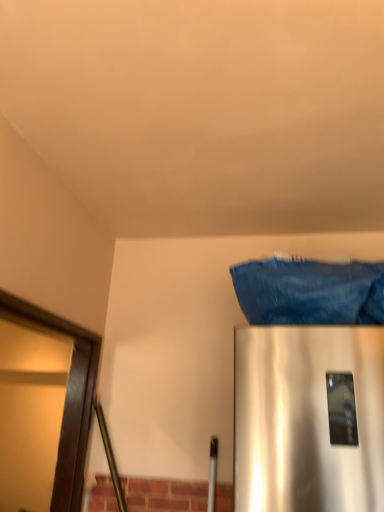
Describe the element at coordinates (310, 292) in the screenshot. This screenshot has height=512, width=384. I see `denim fabric at upper right` at that location.

Where is `denim fabric at upper right`? denim fabric at upper right is located at coordinates [310, 292].

The image size is (384, 512). I want to click on dark brown wooden frame at left, so click(x=66, y=397).

In the scene shown: Measure the distance between point (68, 413) and camera.

They are 1.82 meters apart.

Image resolution: width=384 pixels, height=512 pixels. What do you see at coordinates (66, 397) in the screenshot? I see `dark brown wooden frame at left` at bounding box center [66, 397].

Identify the location of denim fabric at upper right. This screenshot has height=512, width=384. (310, 292).

Can you confirm if dark brown wooden frame at left is positioned to the left of denim fabric at upper right?

Indeed, dark brown wooden frame at left is positioned on the left side of denim fabric at upper right.

In the image, is dark brown wooden frame at left positioned in front of or behind denim fabric at upper right?

dark brown wooden frame at left is positioned closer to the viewer than denim fabric at upper right.

Which is behind, point (85, 414) or point (350, 302)?

The point (85, 414) is farther.

From the image's perspective, is dark brown wooden frame at left on denim fabric at upper right?

No, from the image's perspective, dark brown wooden frame at left is not over denim fabric at upper right.

From a real-world perspective, is dark brown wooden frame at left positioned above or below denim fabric at upper right?

In terms of real-world spatial position, dark brown wooden frame at left is below denim fabric at upper right.

Can you confirm if dark brown wooden frame at left is thinner than denim fabric at upper right?

Indeed, dark brown wooden frame at left has a lesser width compared to denim fabric at upper right.

Is dark brown wooden frame at left taller than denim fabric at upper right?

Correct, dark brown wooden frame at left is much taller as denim fabric at upper right.

Based on their sizes in the image, would you say dark brown wooden frame at left is bigger or smaller than denim fabric at upper right?

Clearly, dark brown wooden frame at left is larger in size than denim fabric at upper right.

From the picture: Is dark brown wooden frame at left located outside denim fabric at upper right?

Yes.

Is dark brown wooden frame at left with denim fabric at upper right?

No, dark brown wooden frame at left is not next to denim fabric at upper right.

Is dark brown wooden frame at left oriented away from denim fabric at upper right?

No, dark brown wooden frame at left is not facing the opposite direction of denim fabric at upper right.

Find the location of a particular element. The image size is (384, 512). material located above the dark brown wooden frame at left (from the image's perspective) is located at coordinates (310, 292).

Does denim fabric at upper right appear on the right side of dark brown wooden frame at left?

Indeed, denim fabric at upper right is positioned on the right side of dark brown wooden frame at left.

Considering the positions of objects denim fabric at upper right and dark brown wooden frame at left in the image provided, who is in front, denim fabric at upper right or dark brown wooden frame at left?

dark brown wooden frame at left.

Which is closer to the camera, (x=357, y=276) or (x=75, y=349)?

Point (x=357, y=276) is positioned closer to the camera compared to point (x=75, y=349).

From the image's perspective, relative to dark brown wooden frame at left, is denim fabric at upper right above or below?

Clearly, from the image's perspective, denim fabric at upper right is above dark brown wooden frame at left.

From a real-world perspective, which object rests below the other?

dark brown wooden frame at left is physically lower.

Is denim fabric at upper right wider than dark brown wooden frame at left?

Yes, denim fabric at upper right is wider than dark brown wooden frame at left.

Does denim fabric at upper right have a lesser height compared to dark brown wooden frame at left?

Yes, denim fabric at upper right is shorter than dark brown wooden frame at left.

Which of these two, denim fabric at upper right or dark brown wooden frame at left, is smaller?

denim fabric at upper right is smaller.

Is denim fabric at upper right not within dark brown wooden frame at left?

Indeed, denim fabric at upper right is completely outside dark brown wooden frame at left.

Is denim fabric at upper right far from dark brown wooden frame at left?

No, denim fabric at upper right is in close proximity to dark brown wooden frame at left.

Is denim fabric at upper right oriented away from dark brown wooden frame at left?

denim fabric at upper right does not have its back to dark brown wooden frame at left.

Find the location of `material that appears on the right of dark brown wooden frame at left`. material that appears on the right of dark brown wooden frame at left is located at coordinates [x=310, y=292].

Find the location of a particular element. glass door below the denim fabric at upper right (from the image's perspective) is located at coordinates (66, 397).

The height and width of the screenshot is (512, 384). What are the coordinates of `material located above the dark brown wooden frame at left (from the image's perspective)` in the screenshot? It's located at (310, 292).